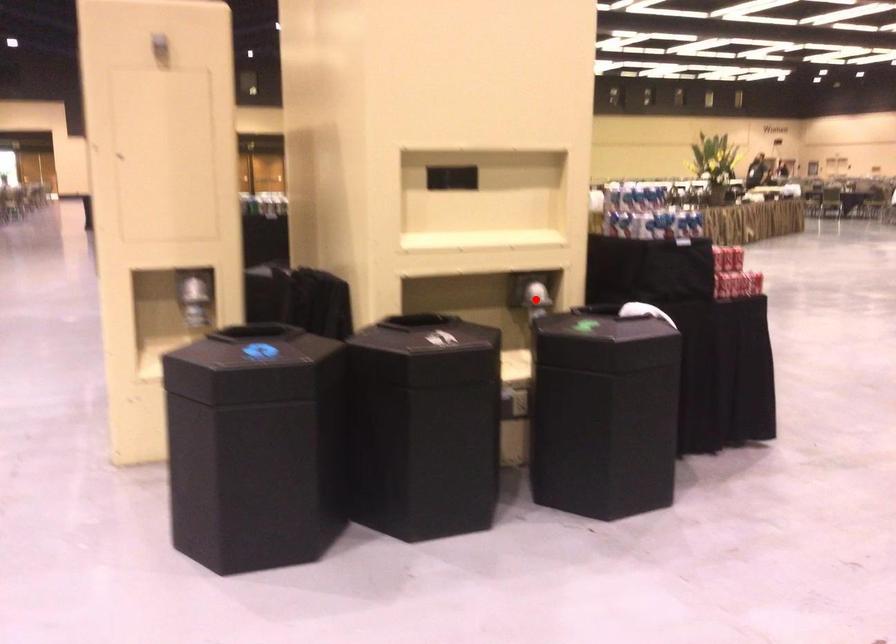
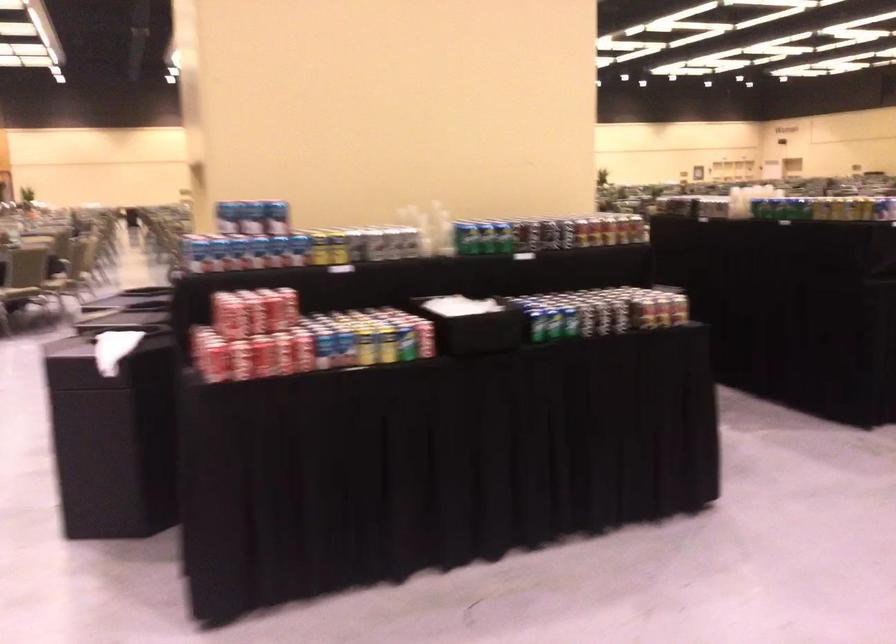
Question: I am providing you with two images of the same scene from different viewpoints. A red point is marked on the first image. Is the red point's position out of view in image 2?

Choices:
 (A) Yes
 (B) No

Answer: (A)